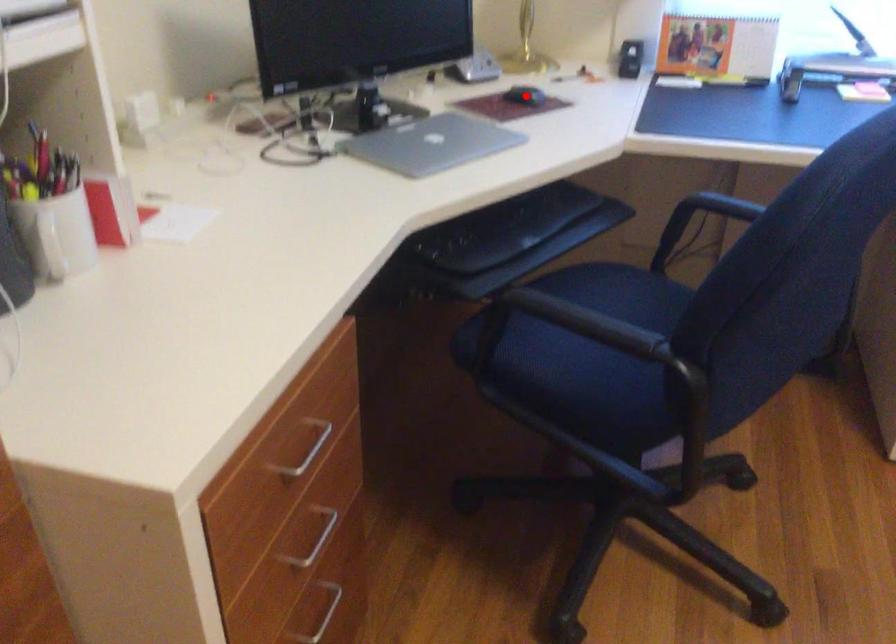
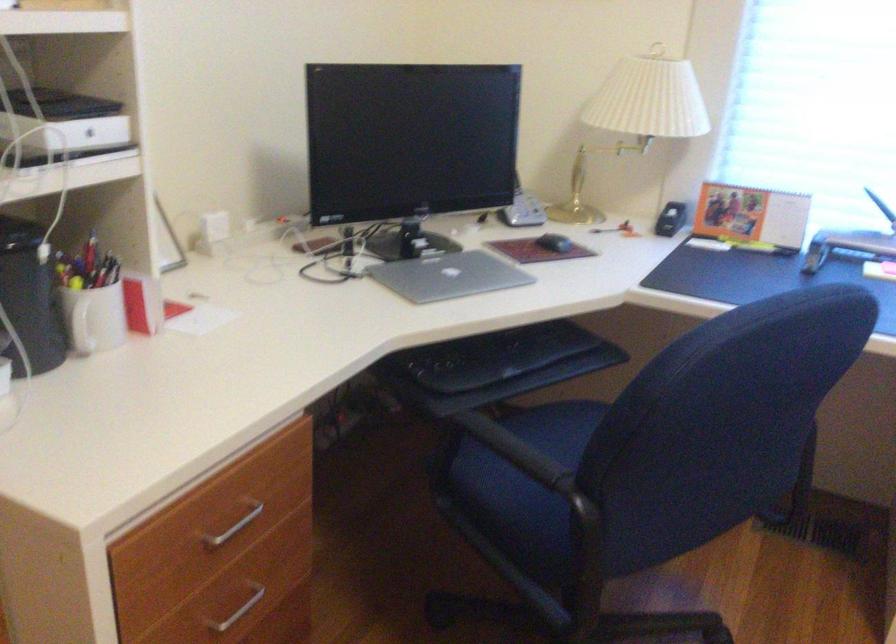
In the second image, find the point that corresponds to the highlighted location in the first image.

(554, 243)